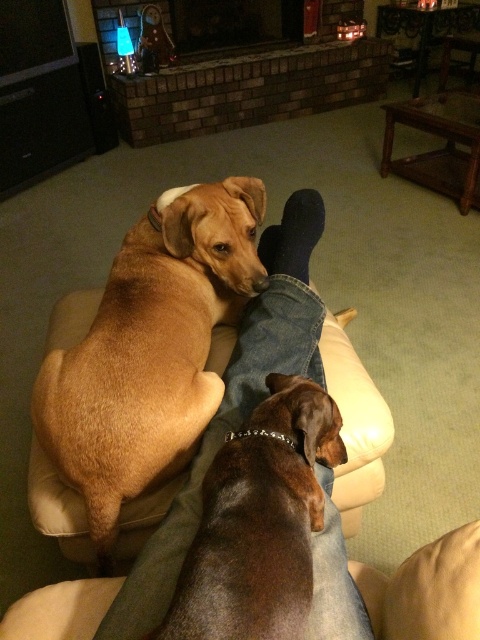
Question: Considering the real-world distances, which object is farthest from the brick fireplace at upper center?

Choices:
 (A) brown shiny dog at center
 (B) brown furry dog at center

Answer: (A)

Question: Which of the following is the closest to the observer?

Choices:
 (A) brick fireplace at upper center
 (B) brown shiny dog at center
 (C) brown furry dog at center

Answer: (B)

Question: Is brown furry dog at center further to camera compared to brick fireplace at upper center?

Choices:
 (A) yes
 (B) no

Answer: (B)

Question: Is brown shiny dog at center closer to the viewer compared to brick fireplace at upper center?

Choices:
 (A) no
 (B) yes

Answer: (B)

Question: Which point is farther to the camera?

Choices:
 (A) brown shiny dog at center
 (B) brown furry dog at center

Answer: (B)

Question: Is brown furry dog at center closer to camera compared to brown shiny dog at center?

Choices:
 (A) no
 (B) yes

Answer: (A)